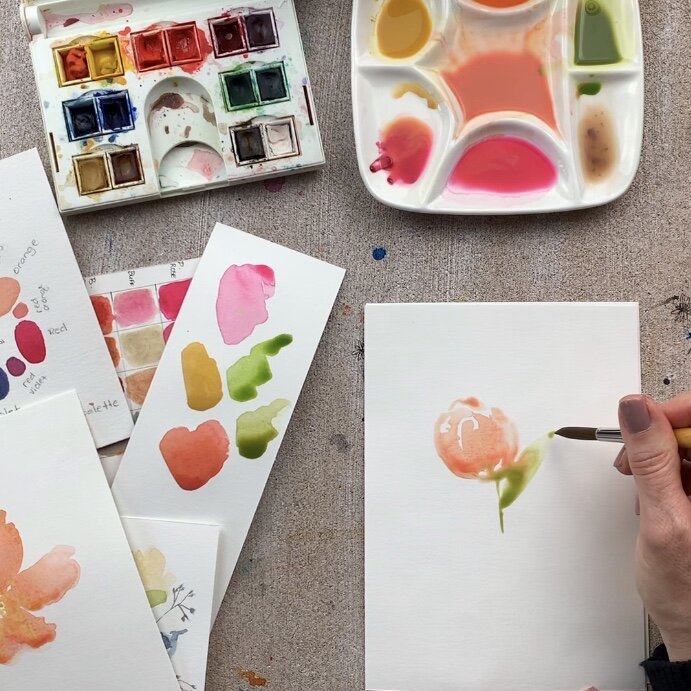
Image resolution: width=691 pixels, height=691 pixels. Find the location of `white plate`. white plate is located at coordinates (594, 200).